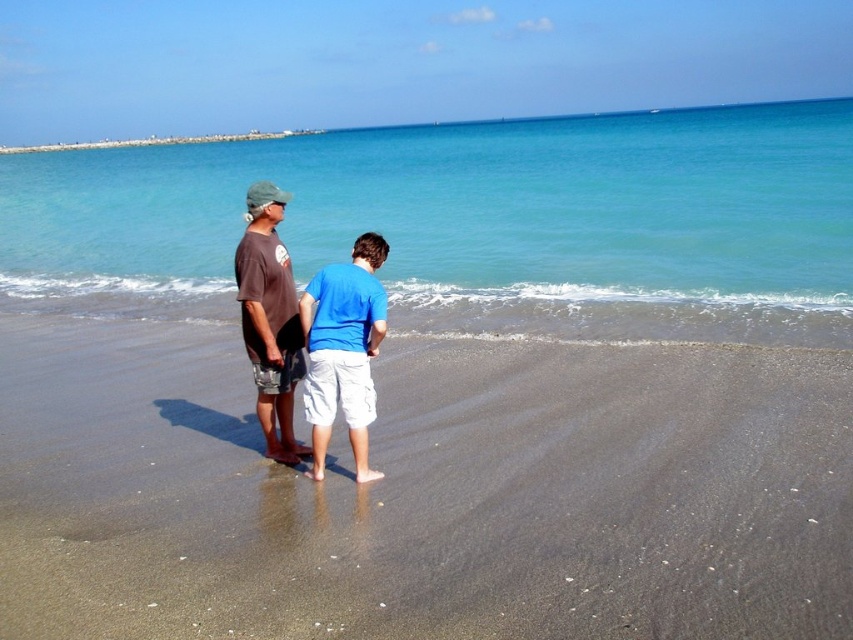
Describe the element at coordinates (450, 484) in the screenshot. I see `dark brown sand at lower center` at that location.

Which is behind, point (247, 516) or point (285, 289)?

The point (285, 289) is more distant.

The image size is (853, 640). I want to click on dark brown sand at lower center, so click(x=450, y=484).

Is point (808, 513) less distant than point (468, 220)?

Yes, it is.

Is dark brown sand at lower center taller than clear blue water at center?

Incorrect, dark brown sand at lower center's height is not larger of clear blue water at center's.

Measure the distance between point [601,545] and camera.

A distance of 4.54 meters exists between point [601,545] and camera.

Identify the location of dark brown sand at lower center. (450, 484).

Which is more to the left, dark brown sand at lower center or blue cotton shirt at center?

dark brown sand at lower center is more to the left.

Is point (126, 490) behind point (360, 476)?

Yes, point (126, 490) is farther from viewer.

Where is `dark brown sand at lower center`? The image size is (853, 640). dark brown sand at lower center is located at coordinates (450, 484).